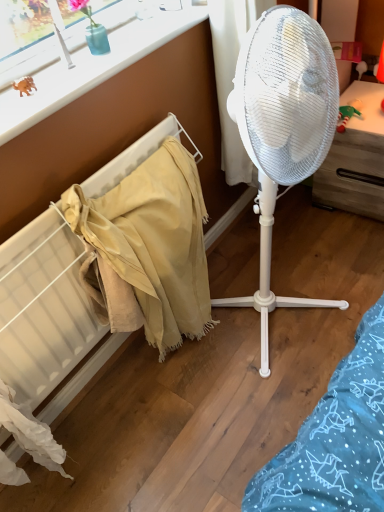
Question: From the image's perspective, does beige fabric at left appear lower than rubber orange dinosaur at upper left?

Choices:
 (A) yes
 (B) no

Answer: (A)

Question: Considering the relative sizes of beige fabric at left and rubber orange dinosaur at upper left in the image provided, is beige fabric at left wider than rubber orange dinosaur at upper left?

Choices:
 (A) yes
 (B) no

Answer: (A)

Question: Can you confirm if beige fabric at left is smaller than rubber orange dinosaur at upper left?

Choices:
 (A) yes
 (B) no

Answer: (B)

Question: Could you tell me if beige fabric at left is facing rubber orange dinosaur at upper left?

Choices:
 (A) yes
 (B) no

Answer: (B)

Question: Is beige fabric at left outside rubber orange dinosaur at upper left?

Choices:
 (A) no
 (B) yes

Answer: (B)

Question: Is beige fabric at left bigger than rubber orange dinosaur at upper left?

Choices:
 (A) yes
 (B) no

Answer: (A)

Question: Is beige fabric at left outside of white plastic window frame at upper left?

Choices:
 (A) yes
 (B) no

Answer: (A)

Question: Does beige fabric at left have a greater height compared to white plastic window frame at upper left?

Choices:
 (A) no
 (B) yes

Answer: (B)

Question: Is white plastic window frame at upper left completely or partially inside beige fabric at left?

Choices:
 (A) yes
 (B) no

Answer: (B)

Question: Is beige fabric at left shorter than white plastic window frame at upper left?

Choices:
 (A) no
 (B) yes

Answer: (A)

Question: From a real-world perspective, is beige fabric at left under white plastic window frame at upper left?

Choices:
 (A) yes
 (B) no

Answer: (A)

Question: Considering the relative sizes of beige fabric at left and white plastic window frame at upper left in the image provided, is beige fabric at left bigger than white plastic window frame at upper left?

Choices:
 (A) yes
 (B) no

Answer: (A)

Question: From the image's perspective, is white plastic fan at center over rubber orange dinosaur at upper left?

Choices:
 (A) yes
 (B) no

Answer: (B)